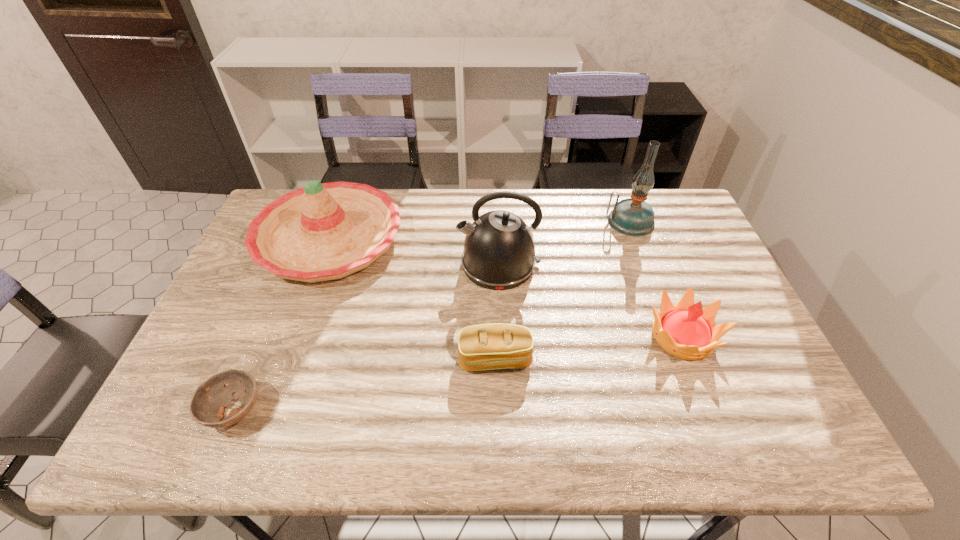
This screenshot has width=960, height=540. Find the location of `oil lamp`. oil lamp is located at coordinates (634, 217).

Find the location of `kettle`. kettle is located at coordinates (499, 253).

Where is `the third tallest object`? This screenshot has width=960, height=540. the third tallest object is located at coordinates [x=325, y=231].

This screenshot has width=960, height=540. Find the location of `the fourth tallest object`. the fourth tallest object is located at coordinates click(x=685, y=330).

The width and height of the screenshot is (960, 540). Find the location of `the second shortest object`. the second shortest object is located at coordinates (486, 346).

Where is `the shortest object`? the shortest object is located at coordinates [x=207, y=406].

I want to click on the nearest object, so click(207, 406).

At what (x,y) coordinates should I click in order to perform the action: click on vacant space positioned 0.090m on the back of the oil lamp. Please return your answer as a coordinate pair (x, y). This screenshot has width=960, height=540. Looking at the image, I should click on (618, 192).

At what (x,y) coordinates should I click in order to perform the action: click on blank space located 0.380m on the spout of the kettle. Please return your answer as a coordinate pair (x, y). Looking at the image, I should click on (332, 265).

You are a GUI agent. You are given a task and a screenshot of the screen. Output one action in this format:
    pyautogui.click(x=<x>, y=<y>)
    Task: Click on the free space located 0.110m on the spout of the kettle
    The height and width of the screenshot is (540, 960).
    Given the screenshot: What is the action you would take?
    pyautogui.click(x=421, y=265)